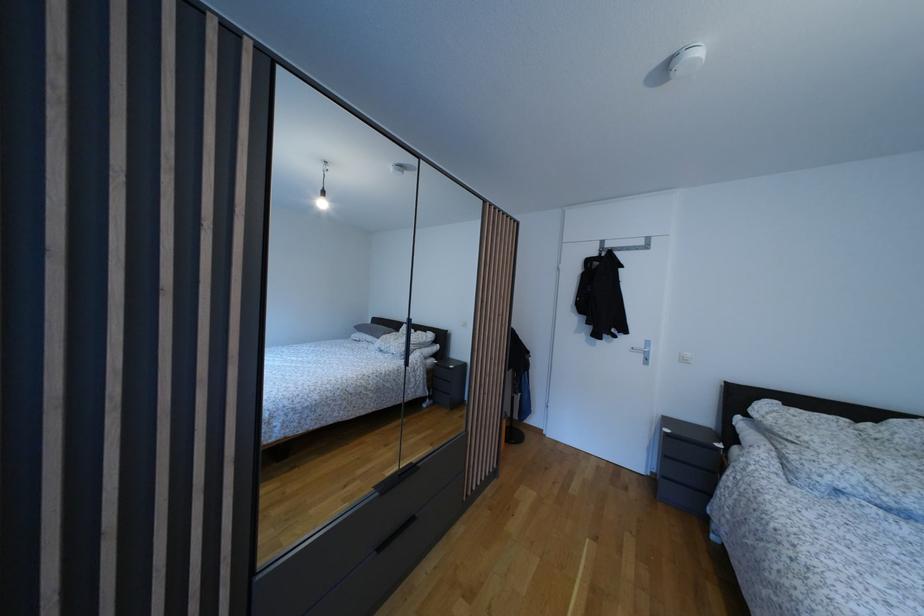
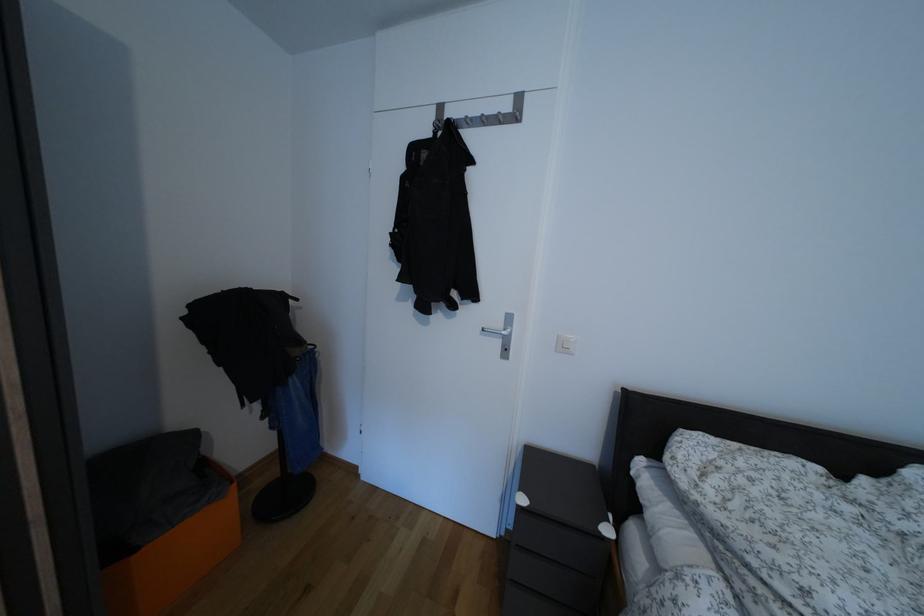
The images are taken continuously from a first-person perspective. In which direction are you moving?

The cameraman walked toward right, forward.